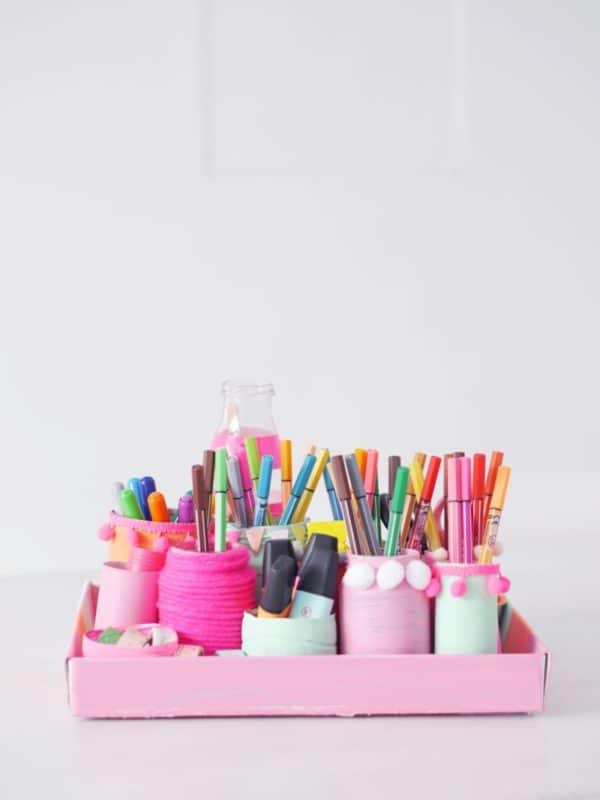
This screenshot has width=600, height=800. In order to click on green marker in this screenshot , I will do `click(249, 464)`, `click(218, 492)`, `click(130, 497)`, `click(391, 530)`.